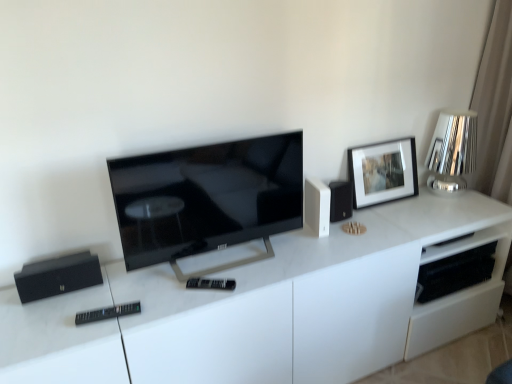
Question: Should I look upward or downward to see black plastic remote at lower left, marked as the 1th remote in a bottom-to-top arrangement?

Choices:
 (A) down
 (B) up

Answer: (A)

Question: Can we say black plastic remote at center, the 1th remote when ordered from right to left, lies outside black matte speaker at left?

Choices:
 (A) no
 (B) yes

Answer: (B)

Question: From the image's perspective, is black plastic remote at center, placed as the second remote when sorted from left to right, located beneath black matte speaker at left?

Choices:
 (A) no
 (B) yes

Answer: (B)

Question: From the image's perspective, is black plastic remote at center, which appears as the 2th remote when ordered from the bottom, over black matte speaker at left?

Choices:
 (A) no
 (B) yes

Answer: (A)

Question: Is black plastic remote at center, which appears as the 2th remote when ordered from the bottom, not near black matte speaker at left?

Choices:
 (A) yes
 (B) no

Answer: (B)

Question: Is black plastic remote at center, acting as the 1th remote starting from the back, turned away from black matte speaker at left?

Choices:
 (A) yes
 (B) no

Answer: (B)

Question: Considering the relative sizes of black plastic remote at center, the 1th remote when ordered from right to left, and black matte speaker at left in the image provided, is black plastic remote at center, the 1th remote when ordered from right to left, smaller than black matte speaker at left?

Choices:
 (A) no
 (B) yes

Answer: (B)

Question: Can you confirm if white matte speaker at upper right is wider than black plastic remote at lower left, acting as the first remote starting from the left?

Choices:
 (A) yes
 (B) no

Answer: (A)

Question: Does white matte speaker at upper right have a lesser height compared to black plastic remote at lower left, the 1th remote in the front-to-back sequence?

Choices:
 (A) yes
 (B) no

Answer: (B)

Question: From the image's perspective, is white matte speaker at upper right above black plastic remote at lower left, acting as the first remote starting from the left?

Choices:
 (A) yes
 (B) no

Answer: (A)

Question: Is white matte speaker at upper right next to black plastic remote at lower left, marked as the 2th remote in a back-to-front arrangement, and touching it?

Choices:
 (A) yes
 (B) no

Answer: (B)

Question: Is white matte speaker at upper right looking in the opposite direction of black plastic remote at lower left, acting as the first remote starting from the left?

Choices:
 (A) yes
 (B) no

Answer: (B)

Question: Considering the relative sizes of white matte speaker at upper right and black plastic remote at lower left, the 1th remote in the front-to-back sequence, in the image provided, is white matte speaker at upper right thinner than black plastic remote at lower left, the 1th remote in the front-to-back sequence,?

Choices:
 (A) yes
 (B) no

Answer: (B)

Question: Would you say black plastic remote at center, the second remote positioned from the front, is a long distance from black plastic remote at lower left, acting as the first remote starting from the left?

Choices:
 (A) yes
 (B) no

Answer: (B)